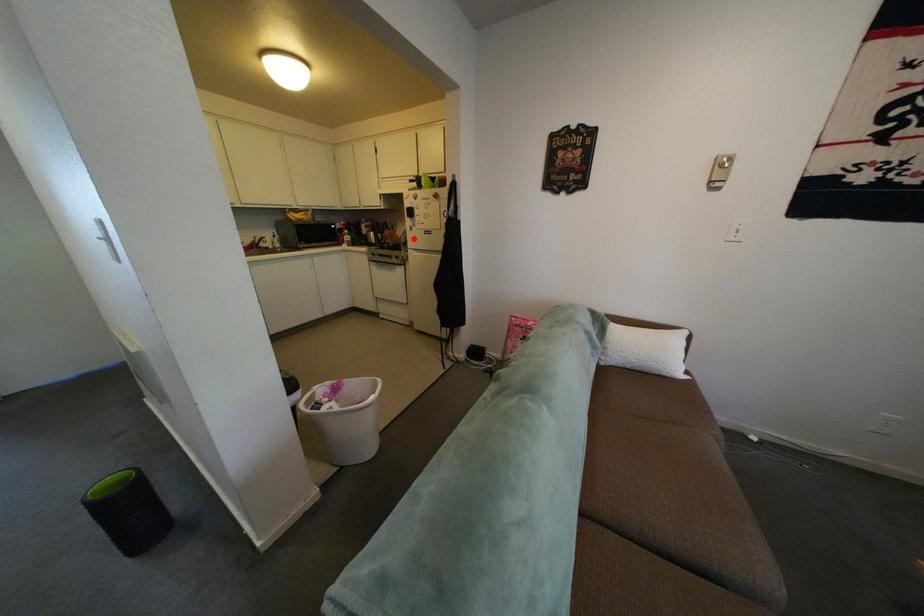
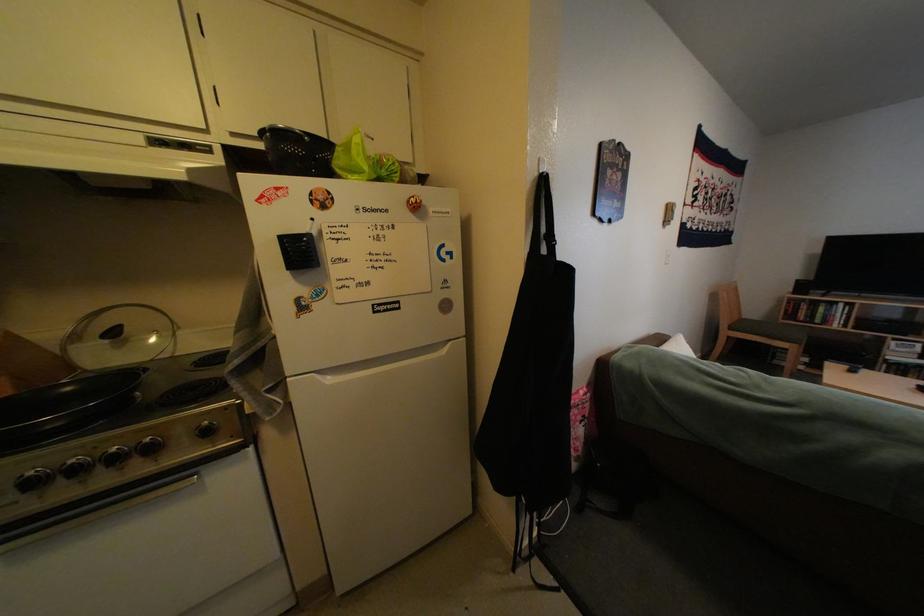
Question: I am providing you with two images of the same scene from different viewpoints. A red point is shown in image1. For the corresponding object point in image2, is it positioned nearer or farther from the camera?

Choices:
 (A) Nearer
 (B) Farther

Answer: (B)